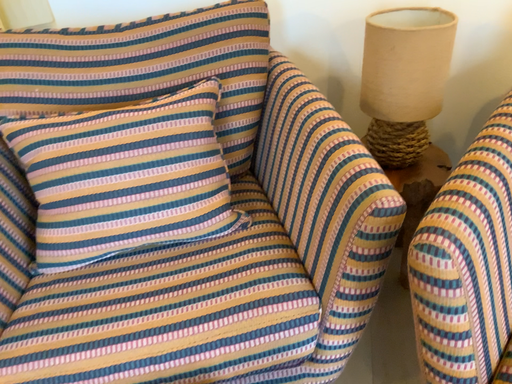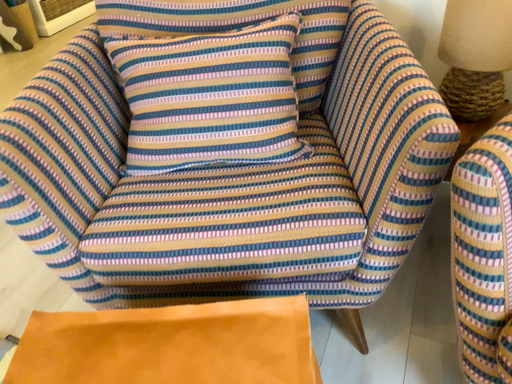
Question: Which way did the camera rotate in the video?

Choices:
 (A) rotated left
 (B) rotated right

Answer: (A)